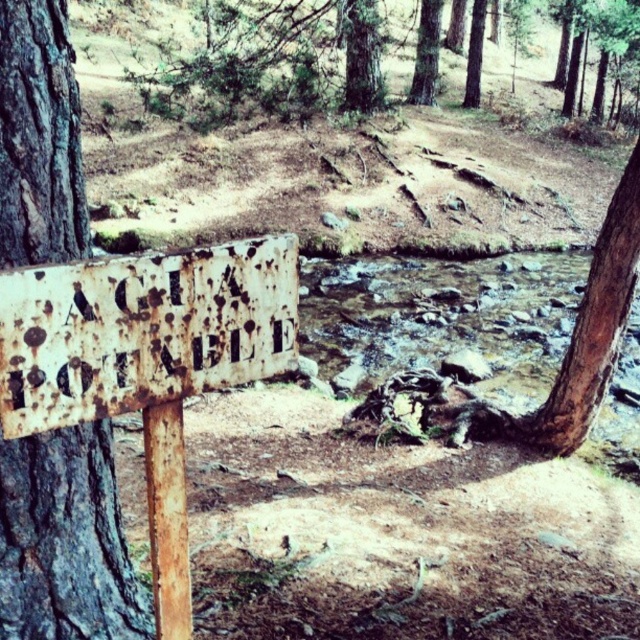
Is rusty metal sign at left further to the viewer compared to rusty metal sign at lower left?

Yes, it is.

Is rusty metal sign at left to the right of rusty metal sign at lower left from the viewer's perspective?

In fact, rusty metal sign at left is to the left of rusty metal sign at lower left.

Is point (65, 573) positioned in front of point (225, 257)?

No, (65, 573) is further to viewer.

At what (x,y) coordinates should I click in order to perform the action: click on rusty metal sign at left. Please return your answer as a coordinate pair (x, y). Looking at the image, I should click on (x=65, y=541).

Who is higher up, green textured bark tree at center or green rough bark tree at upper center?

green rough bark tree at upper center is above.

This screenshot has height=640, width=640. Find the location of `green textured bark tree at center`. green textured bark tree at center is located at coordinates (362, 56).

Where is `green textured bark tree at center`? green textured bark tree at center is located at coordinates (362, 56).

Is point (40, 632) closer to viewer compared to point (422, 10)?

Yes.

Is rusty metal sign at left closer to the viewer compared to green rough bark tree at upper center?

Yes, rusty metal sign at left is closer to the viewer.

Does point (112, 577) lie in front of point (435, 56)?

Yes, point (112, 577) is closer to viewer.

Where is `rusty metal sign at left`? The width and height of the screenshot is (640, 640). rusty metal sign at left is located at coordinates (65, 541).